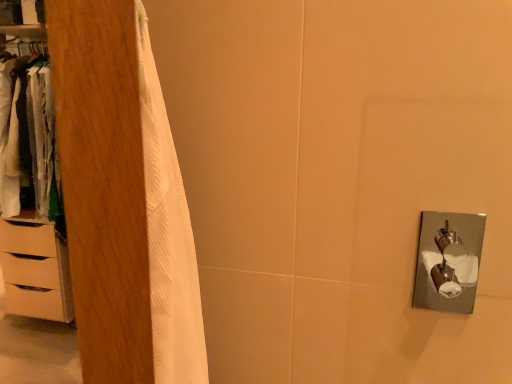
Question: Considering the relative sizes of white wood dresser at left and wooden wardrobe at left in the image provided, is white wood dresser at left wider than wooden wardrobe at left?

Choices:
 (A) yes
 (B) no

Answer: (A)

Question: Is white wood dresser at left closer to camera compared to wooden wardrobe at left?

Choices:
 (A) no
 (B) yes

Answer: (A)

Question: Is there a large distance between white wood dresser at left and wooden wardrobe at left?

Choices:
 (A) yes
 (B) no

Answer: (A)

Question: Considering the relative sizes of white wood dresser at left and wooden wardrobe at left in the image provided, is white wood dresser at left taller than wooden wardrobe at left?

Choices:
 (A) yes
 (B) no

Answer: (A)

Question: From the image's perspective, is white wood dresser at left on top of wooden wardrobe at left?

Choices:
 (A) no
 (B) yes

Answer: (B)

Question: Is white wood dresser at left outside wooden wardrobe at left?

Choices:
 (A) no
 (B) yes

Answer: (B)

Question: Does white matte chest of drawers at left have a greater width compared to wooden wardrobe at left?

Choices:
 (A) no
 (B) yes

Answer: (B)

Question: Considering the relative sizes of white matte chest of drawers at left and wooden wardrobe at left in the image provided, is white matte chest of drawers at left bigger than wooden wardrobe at left?

Choices:
 (A) yes
 (B) no

Answer: (A)

Question: Can you confirm if white matte chest of drawers at left is shorter than wooden wardrobe at left?

Choices:
 (A) yes
 (B) no

Answer: (A)

Question: From a real-world perspective, is white matte chest of drawers at left over wooden wardrobe at left?

Choices:
 (A) yes
 (B) no

Answer: (B)

Question: Can you confirm if white matte chest of drawers at left is thinner than wooden wardrobe at left?

Choices:
 (A) no
 (B) yes

Answer: (A)

Question: From a real-world perspective, is white matte chest of drawers at left under wooden wardrobe at left?

Choices:
 (A) yes
 (B) no

Answer: (A)

Question: Does wooden wardrobe at left have a greater height compared to white matte chest of drawers at left?

Choices:
 (A) yes
 (B) no

Answer: (A)